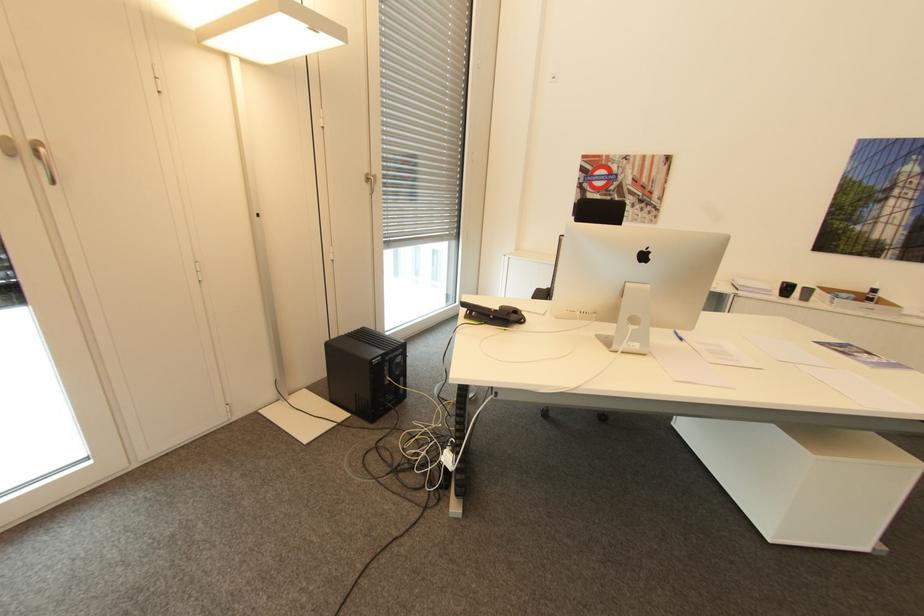
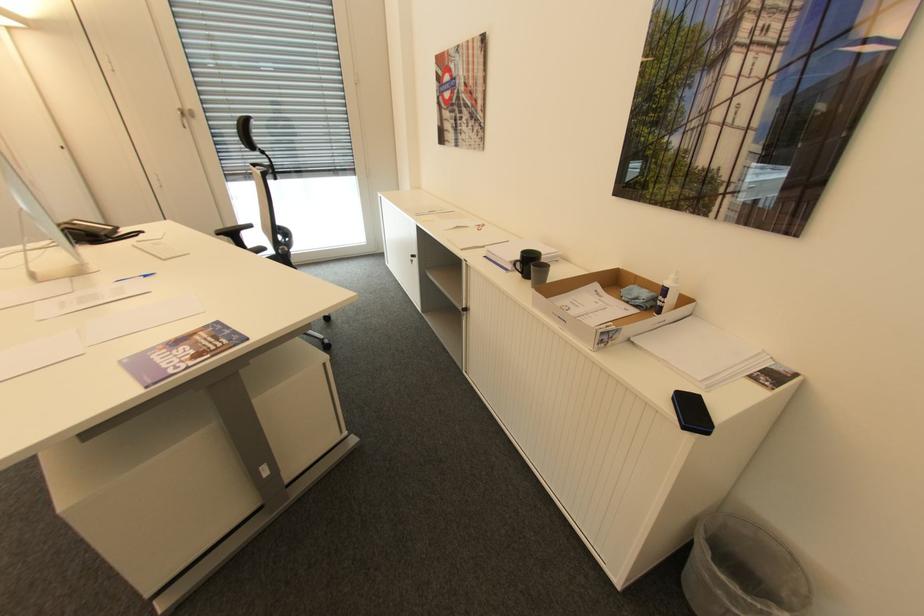
Locate, in the second image, the point that corresponds to (812,289) in the first image.

(550, 268)